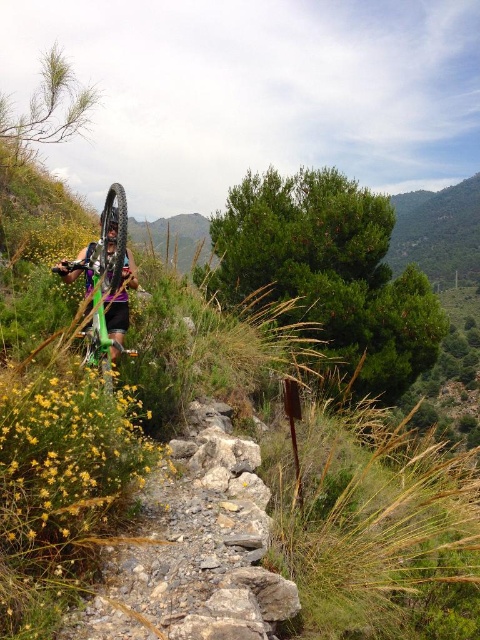
Is rocky gravel trail at center closer to the viewer compared to green matte bicycle at center?

Yes, it is.

Between point (276, 611) and point (133, 278), which one is positioned in front?

Positioned in front is point (276, 611).

Locate an element on the screen. rocky gravel trail at center is located at coordinates (197, 548).